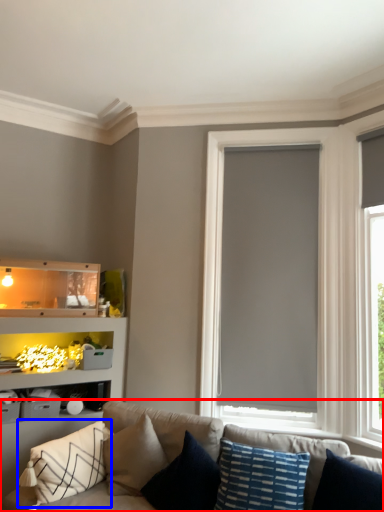
Question: Which object appears closest to the camera in this image, studio couch (highlighted by a red box) or pillow (highlighted by a blue box)?

Choices:
 (A) studio couch
 (B) pillow

Answer: (A)